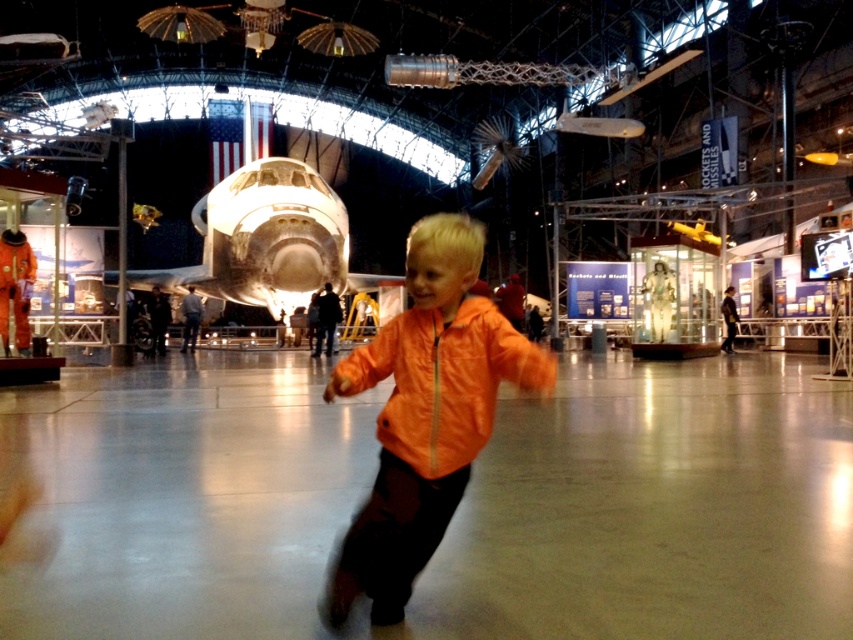
Between orange shiny jacket at center and orange matte jacket at center, which one appears on the left side from the viewer's perspective?

orange shiny jacket at center

The height and width of the screenshot is (640, 853). I want to click on orange shiny jacket at center, so click(425, 413).

Is point (409, 342) in front of point (485, 352)?

No, it is not.

What are the coordinates of `orange shiny jacket at center` in the screenshot? It's located at (425, 413).